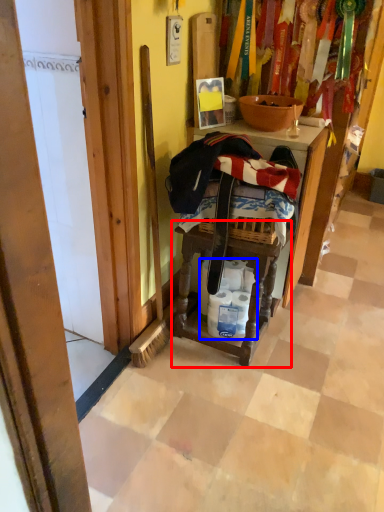
Question: Among these objects, which one is nearest to the camera, step stool (highlighted by a red box) or toilet paper (highlighted by a blue box)?

Choices:
 (A) step stool
 (B) toilet paper

Answer: (A)